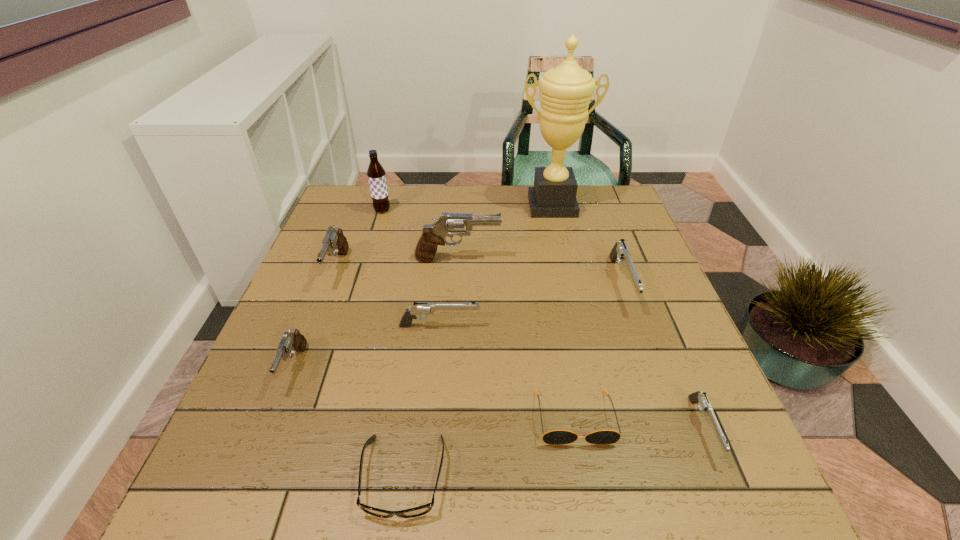
Locate an element on the screen. The width and height of the screenshot is (960, 540). the smallest gray pistol is located at coordinates (291, 341).

The height and width of the screenshot is (540, 960). In order to click on the fifth farthest pistol in this screenshot , I will do `click(291, 341)`.

Image resolution: width=960 pixels, height=540 pixels. I want to click on the fourth farthest pistol, so pos(421,308).

Locate an element on the screen. This screenshot has width=960, height=540. the fifth tallest pistol is located at coordinates (421, 308).

Find the location of a particular element. The height and width of the screenshot is (540, 960). the rightmost silver pistol is located at coordinates (697, 397).

Identify the location of the shortest pistol. The width and height of the screenshot is (960, 540). (697, 397).

I want to click on black sunglasses, so click(x=556, y=437).

The width and height of the screenshot is (960, 540). What are the coordinates of `the shortest object` in the screenshot? It's located at (424, 509).

Find the location of a particular element. This screenshot has width=960, height=540. free region located 0.130m at the front of the yellow trophy cup with handles is located at coordinates (562, 246).

The width and height of the screenshot is (960, 540). In order to click on vacant region located 0.400m on the front of the brown root beer in this screenshot , I will do `click(351, 311)`.